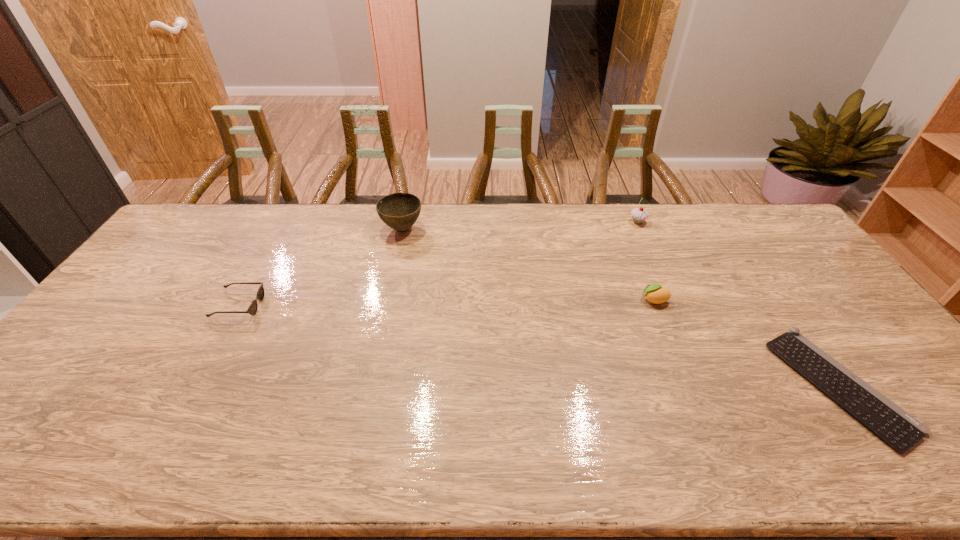
The image size is (960, 540). Identify the location of blank space located with leaves positioned above the lemon. (535, 300).

At what (x,y) coordinates should I click in order to perform the action: click on blank space located with leaves positioned above the lemon. Please return your answer as a coordinate pair (x, y). Looking at the image, I should click on (555, 300).

I want to click on vacant space located 0.220m on the front lenses of the sunglasses, so click(335, 306).

Where is `free region located 0.070m on the left of the computer keyboard`? free region located 0.070m on the left of the computer keyboard is located at coordinates (759, 386).

Locate an element on the screen. The image size is (960, 540). bowl that is at the far edge is located at coordinates (399, 211).

Image resolution: width=960 pixels, height=540 pixels. I want to click on cupcake that is positioned at the far edge, so click(639, 215).

Identify the location of object positioned at the near edge. (899, 429).

Where is `object situated at the right edge`? This screenshot has width=960, height=540. object situated at the right edge is located at coordinates (899, 429).

What are the coordinates of `object that is positioned at the near right corner` in the screenshot? It's located at (899, 429).

Where is `blank space at the far edge of the desktop`? The image size is (960, 540). blank space at the far edge of the desktop is located at coordinates (375, 232).